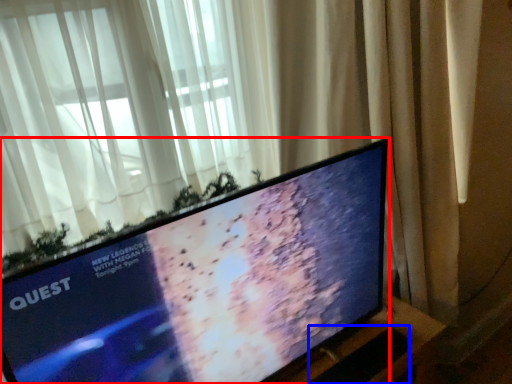
Question: Which object appears closest to the camera in this image, television (highlighted by a red box) or laptop keyboard (highlighted by a blue box)?

Choices:
 (A) television
 (B) laptop keyboard

Answer: (A)